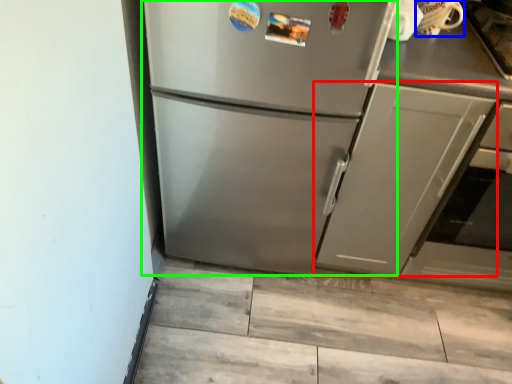
Question: Which object is the closest to the cabinetry (highlighted by a red box)? Choose among these: appliance (highlighted by a blue box) or refrigerator (highlighted by a green box).

Choices:
 (A) appliance
 (B) refrigerator

Answer: (B)